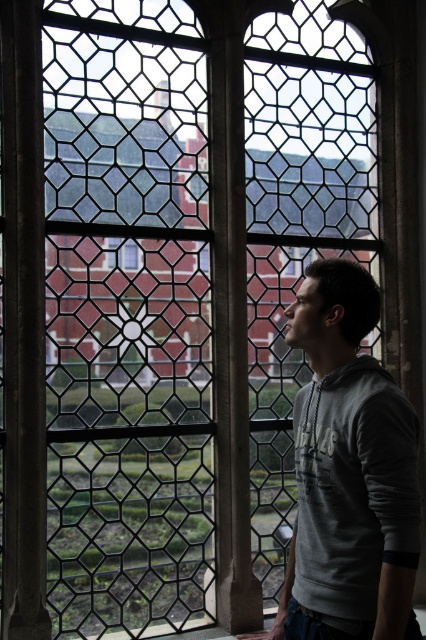
You are standing inside a building and looking through the clear glass window at center. There is a dark gray stone pillar at left in your view. Based on your position, is the pillar closer to you or further away than the window?

The dark gray stone pillar at left is below the clear glass window at center, so the pillar is closer to you than the window.

You are an architect examining the stained glass window. You notice the dark gray stone pillar at left and the clear glass window at center. Which object occupies more vertical space in the scene?

The dark gray stone pillar at left is much taller than the clear glass window at center, so it occupies more vertical space.

You are standing inside a room with a large stained glass window. You see a gray hoodie at center and a dark gray stone pillar at left. If you want to hang the gray hoodie on the pillar, will the hoodie fit around the pillar without folding it?

The gray hoodie at center might be wider than dark gray stone pillar at left, so there is a possibility that the hoodie can fit around the pillar without folding, but it depends on the exact width measurements.